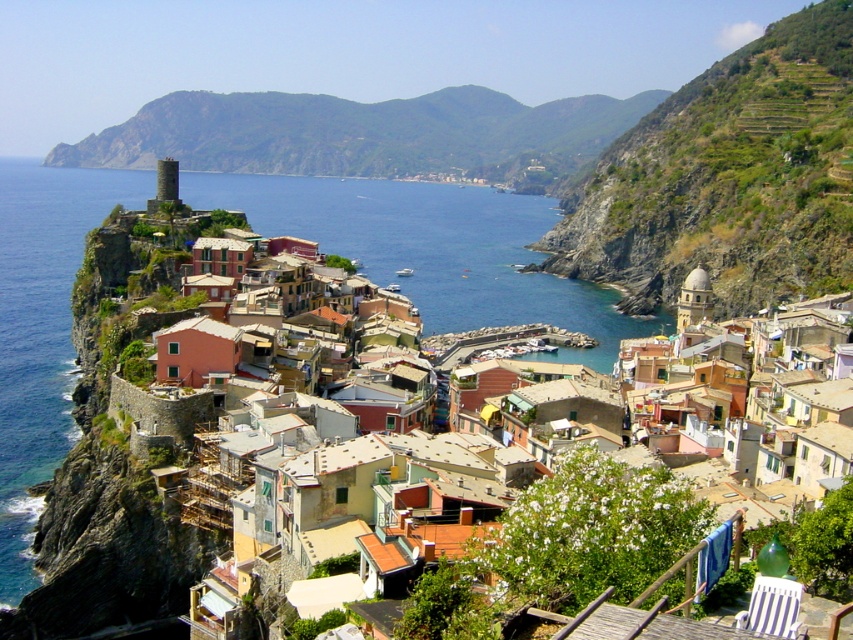
Who is shorter, green grassy hillside at upper center or blue water at center?

Standing shorter between the two is green grassy hillside at upper center.

The width and height of the screenshot is (853, 640). What are the coordinates of `green grassy hillside at upper center` in the screenshot? It's located at coord(358,132).

Does green grassy hillside at upper right appear on the left side of blue water at center?

No, green grassy hillside at upper right is not to the left of blue water at center.

In the scene shown: Which of these two, green grassy hillside at upper right or blue water at center, stands shorter?

blue water at center is shorter.

Which is in front, point (706, 220) or point (495, 205)?

Point (706, 220) is in front.

At what (x,y) coordinates should I click in order to perform the action: click on green grassy hillside at upper right. Please return your answer as a coordinate pair (x, y). This screenshot has height=640, width=853. Looking at the image, I should click on (728, 177).

Between green grassy hillside at upper right and green grassy hillside at upper center, which one appears on the left side from the viewer's perspective?

green grassy hillside at upper center is more to the left.

Is green grassy hillside at upper right taller than green grassy hillside at upper center?

Indeed, green grassy hillside at upper right has a greater height compared to green grassy hillside at upper center.

Is point (743, 284) farther from viewer compared to point (202, 163)?

That is False.

The height and width of the screenshot is (640, 853). Identify the location of green grassy hillside at upper right. (728, 177).